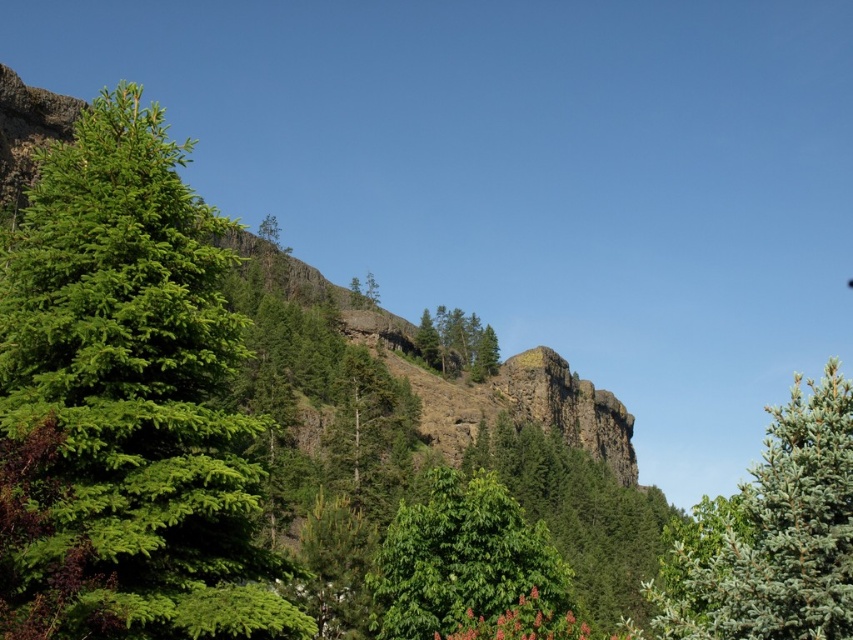
You are a hiker standing at the base of the cliff and want to reach the green matte tree at upper center. There is a green matte tree at right blocking your path. Can you walk around it? Explain your reasoning.

The distance between the green matte tree at right and the green matte tree at upper center is 271.42 feet. Since the trees are far apart, you can walk around the green matte tree at right to reach the green matte tree at upper center.

You are a hiker standing at the base of the brown rocky mountain at center and want to reach the green matte tree at upper center. Which direction should you move to get closer to the tree?

The green matte tree at upper center is further away from you than the brown rocky mountain at center. To get closer to the tree, you should move forward away from the mountain towards the tree.